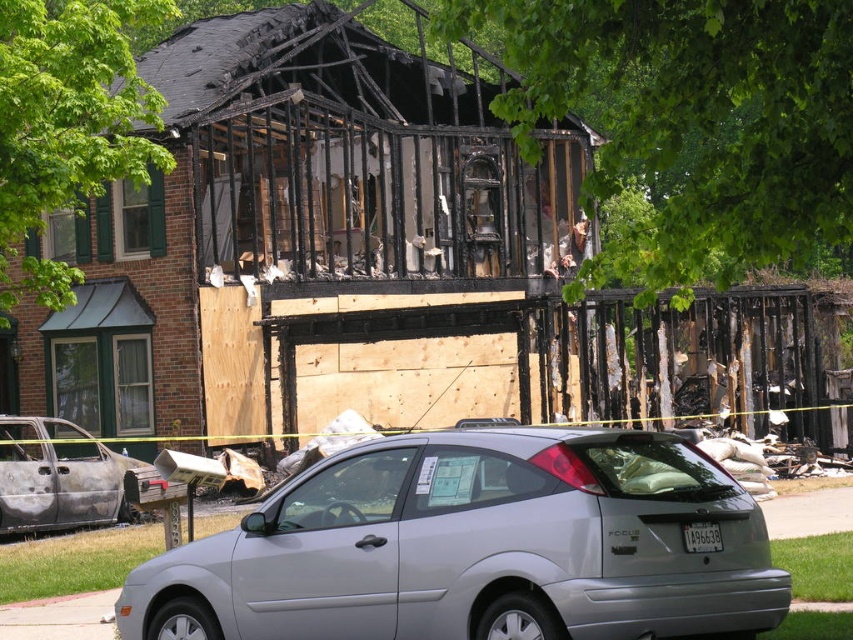
Question: Which point is farther to the camera?

Choices:
 (A) (466, 456)
 (B) (64, 524)

Answer: (B)

Question: Considering the relative positions of silver metallic hatchback at center and burnt metallic car at lower left in the image provided, where is silver metallic hatchback at center located with respect to burnt metallic car at lower left?

Choices:
 (A) left
 (B) right

Answer: (B)

Question: Is silver metallic hatchback at center bigger than burnt metallic car at lower left?

Choices:
 (A) yes
 (B) no

Answer: (A)

Question: In this image, where is silver metallic hatchback at center located relative to burnt metallic car at lower left?

Choices:
 (A) left
 (B) right

Answer: (B)